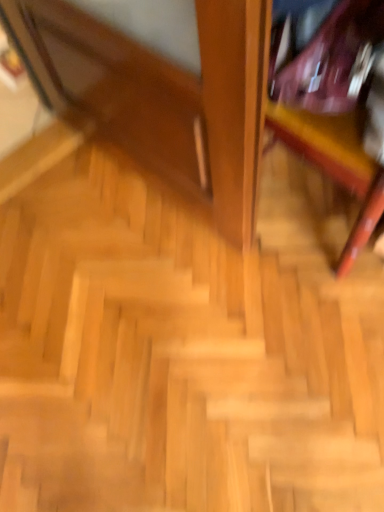
This screenshot has width=384, height=512. I want to click on wooden stairs at center, so click(182, 352).

The image size is (384, 512). What do you see at coordinates (182, 352) in the screenshot?
I see `wooden stairs at center` at bounding box center [182, 352].

I want to click on wooden bookshelf at upper right, so click(x=334, y=100).

What do you see at coordinates (334, 100) in the screenshot?
I see `wooden bookshelf at upper right` at bounding box center [334, 100].

At what (x,y) coordinates should I click in order to perform the action: click on wooden stairs at center. Please return your answer as a coordinate pair (x, y). Looking at the image, I should click on (182, 352).

Considering the relative positions of wooden bookshelf at upper right and wooden stairs at center in the image provided, is wooden bookshelf at upper right to the right of wooden stairs at center from the viewer's perspective?

Yes, wooden bookshelf at upper right is to the right of wooden stairs at center.

In the image, is wooden bookshelf at upper right positioned in front of or behind wooden stairs at center?

wooden bookshelf at upper right is in front of wooden stairs at center.

Does point (364, 78) appear closer or farther from the camera than point (328, 455)?

Point (364, 78) appears to be closer to the viewer than point (328, 455).

Based on the photo, from the image's perspective, which one is positioned higher, wooden bookshelf at upper right or wooden stairs at center?

wooden bookshelf at upper right is shown above in the image.

From a real-world perspective, is wooden bookshelf at upper right above or below wooden stairs at center?

Clearly, from a real-world perspective, wooden bookshelf at upper right is above wooden stairs at center.

Considering the relative sizes of wooden bookshelf at upper right and wooden stairs at center in the image provided, is wooden bookshelf at upper right thinner than wooden stairs at center?

Indeed, wooden bookshelf at upper right has a lesser width compared to wooden stairs at center.

Considering the sizes of wooden bookshelf at upper right and wooden stairs at center in the image, is wooden bookshelf at upper right taller or shorter than wooden stairs at center?

Clearly, wooden bookshelf at upper right is taller compared to wooden stairs at center.

Who is bigger, wooden bookshelf at upper right or wooden stairs at center?

With larger size is wooden bookshelf at upper right.

Can wooden stairs at center be found inside wooden bookshelf at upper right?

No, wooden stairs at center is not surrounded by wooden bookshelf at upper right.

Is wooden bookshelf at upper right far away from wooden stairs at center?

wooden bookshelf at upper right is near wooden stairs at center, not far away.

Does wooden bookshelf at upper right turn towards wooden stairs at center?

Yes, wooden bookshelf at upper right is aimed at wooden stairs at center.

Locate an element on the screen. This screenshot has height=512, width=384. furniture lying on the right of wooden stairs at center is located at coordinates (334, 100).

Which object is positioned more to the left, wooden stairs at center or wooden bookshelf at upper right?

wooden stairs at center.

Considering the positions of objects wooden stairs at center and wooden bookshelf at upper right in the image provided, who is in front, wooden stairs at center or wooden bookshelf at upper right?

wooden bookshelf at upper right is in front.

Which point is more forward, (222,483) or (271,78)?

The point (271,78) is closer.

From the image's perspective, is wooden stairs at center positioned above or below wooden bookshelf at upper right?

From the image's perspective, wooden stairs at center appears below wooden bookshelf at upper right.

From a real-world perspective, is wooden stairs at center on wooden bookshelf at upper right?

No.

Between wooden stairs at center and wooden bookshelf at upper right, which one has smaller width?

wooden bookshelf at upper right is thinner.

Is wooden stairs at center taller than wooden bookshelf at upper right?

Incorrect, the height of wooden stairs at center is not larger of that of wooden bookshelf at upper right.

Is wooden stairs at center bigger or smaller than wooden bookshelf at upper right?

wooden stairs at center is smaller than wooden bookshelf at upper right.

Could wooden bookshelf at upper right be considered to be inside wooden stairs at center?

Definitely not — wooden bookshelf at upper right is not inside wooden stairs at center.

Is wooden stairs at center placed right next to wooden bookshelf at upper right?

wooden stairs at center and wooden bookshelf at upper right are not in contact.

Is wooden stairs at center facing towards wooden bookshelf at upper right?

No.

What's the angular difference between wooden stairs at center and wooden bookshelf at upper right's facing directions?

They differ by 86.9 degrees in their facing directions.

Find the location of a particular element. furniture in front of the wooden stairs at center is located at coordinates (334, 100).

In order to click on furniture to the right of wooden stairs at center in this screenshot , I will do `click(334, 100)`.

This screenshot has height=512, width=384. I want to click on furniture in front of the wooden stairs at center, so click(334, 100).